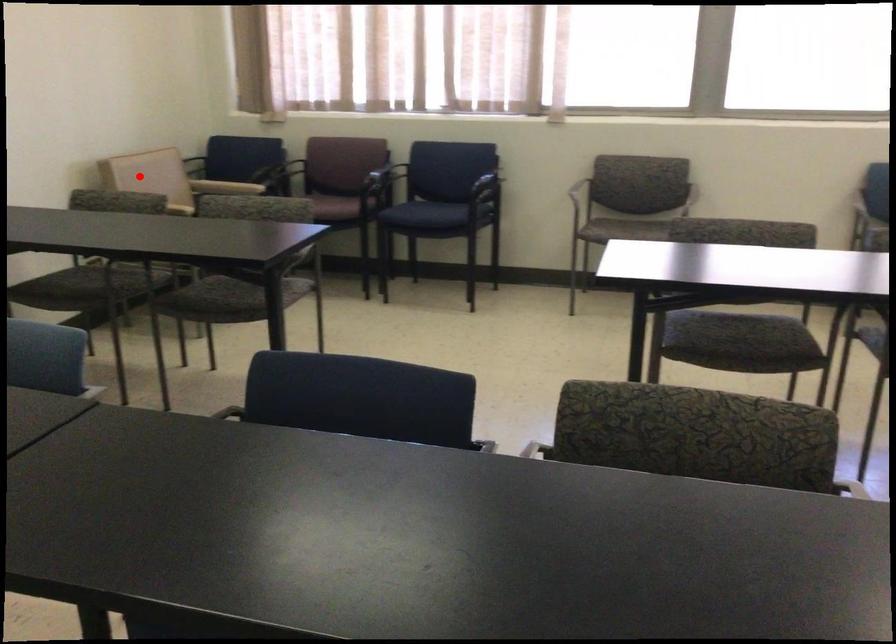
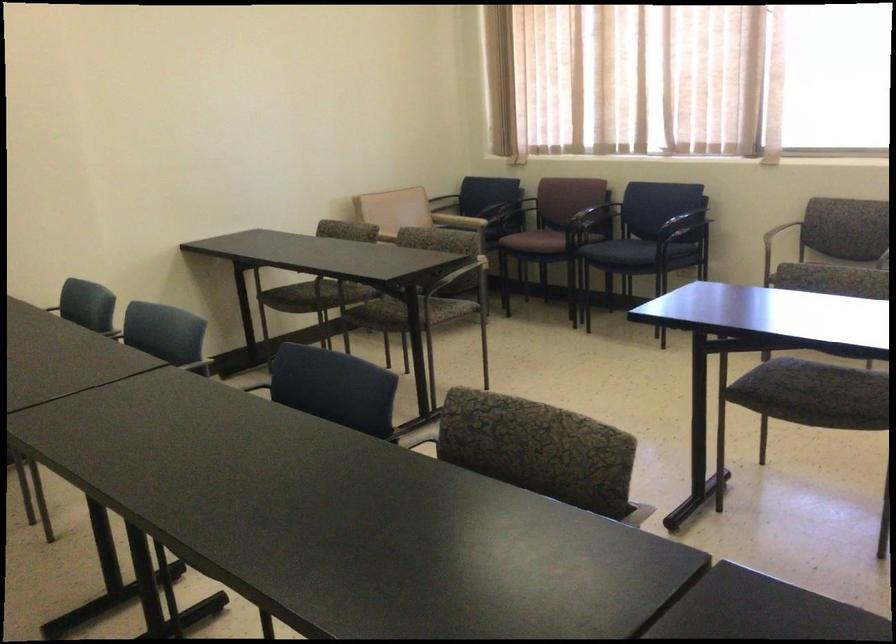
Question: I am providing you with two images of the same scene from different viewpoints. Image1 has a red point marked. In image2, the corresponding 3D location appears at what relative position? Reply with the corresponding letter.

Choices:
 (A) Closer
 (B) Farther

Answer: (B)